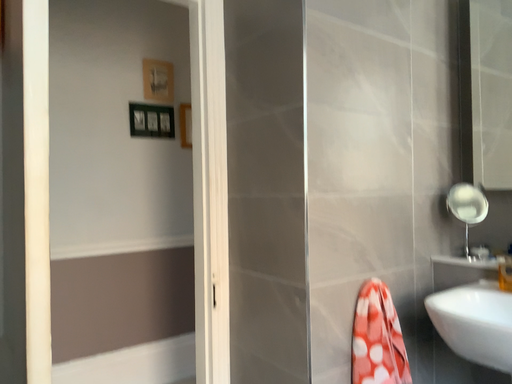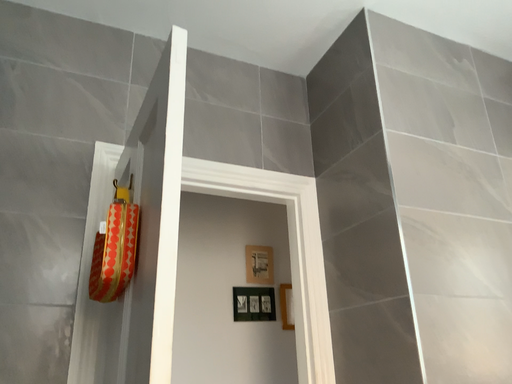
Question: How did the camera likely rotate when shooting the video?

Choices:
 (A) rotated left
 (B) rotated right

Answer: (A)